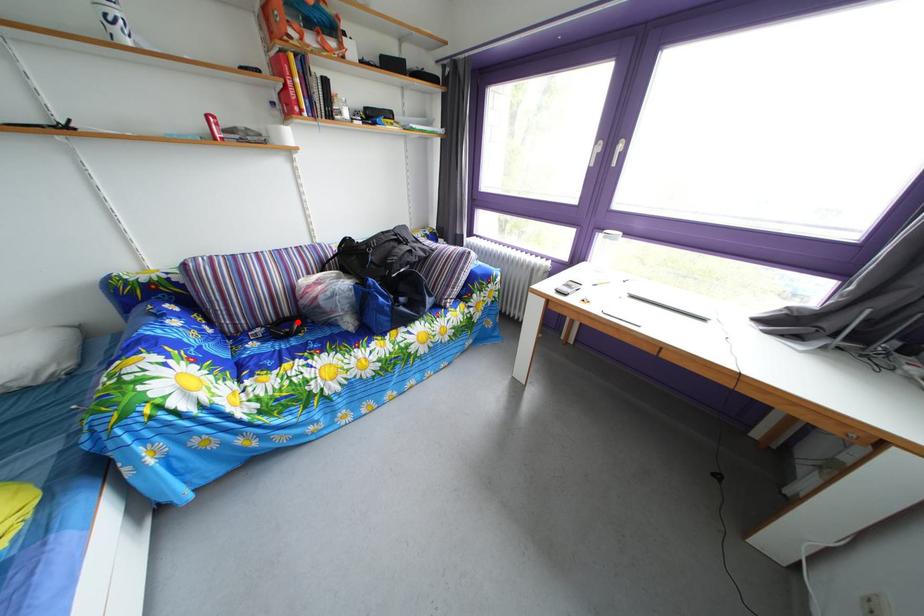
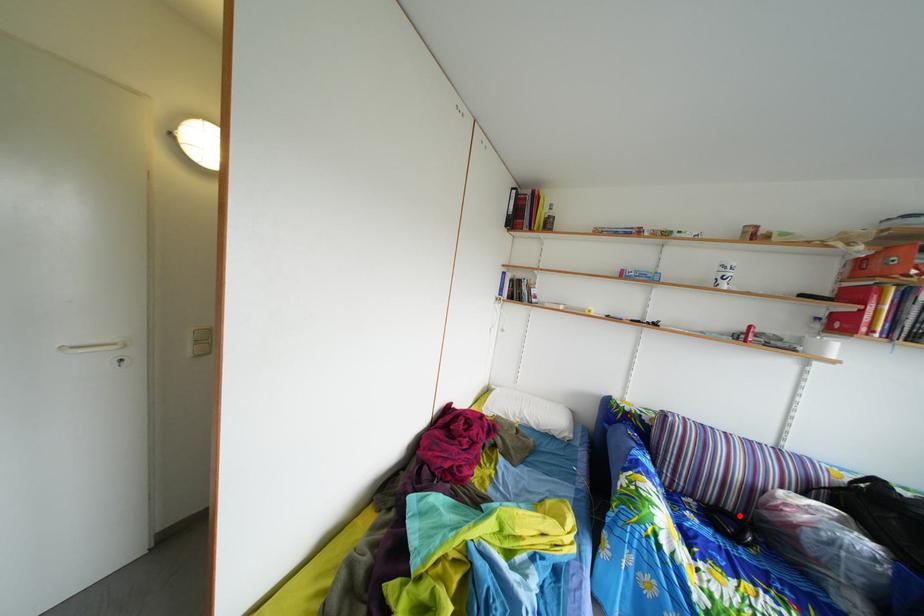
I am providing you with two images of the same scene from different viewpoints. A red point is marked on the first image and another point is marked on the second image. Are the points marked in image1 and image2 representing the same 3D position?

Yes